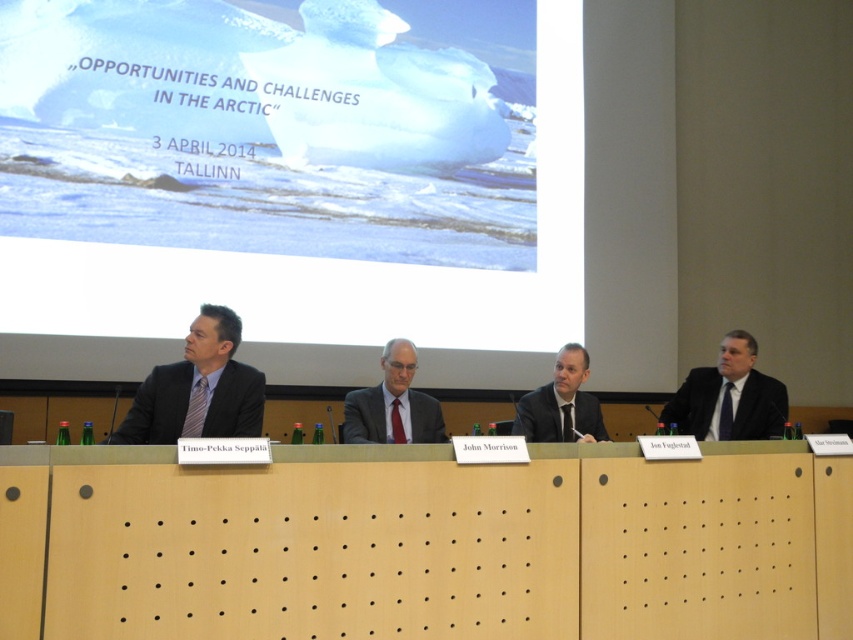
Looking at this image, is wooden at center above dark suit at right?

Actually, wooden at center is below dark suit at right.

Can you confirm if wooden at center is taller than dark suit at right?

Indeed, wooden at center has a greater height compared to dark suit at right.

Which is in front, point (242, 531) or point (708, 429)?

Point (242, 531) is more forward.

This screenshot has width=853, height=640. Identify the location of wooden at center. (434, 545).

How much distance is there between white glossy projection screen at upper center and matte gray suit at center?

The distance of white glossy projection screen at upper center from matte gray suit at center is 4.99 feet.

Is white glossy projection screen at upper center behind matte gray suit at center?

Yes, white glossy projection screen at upper center is further from the viewer.

The width and height of the screenshot is (853, 640). I want to click on white glossy projection screen at upper center, so click(x=293, y=168).

Identify the location of white glossy projection screen at upper center. (293, 168).

Is dark suit at right thinner than dark gray suit at center?

No.

Is point (776, 403) positioned in front of point (572, 436)?

No, (776, 403) is behind (572, 436).

The width and height of the screenshot is (853, 640). What do you see at coordinates (729, 396) in the screenshot?
I see `dark suit at right` at bounding box center [729, 396].

This screenshot has height=640, width=853. In order to click on dark suit at right in this screenshot , I will do `click(729, 396)`.